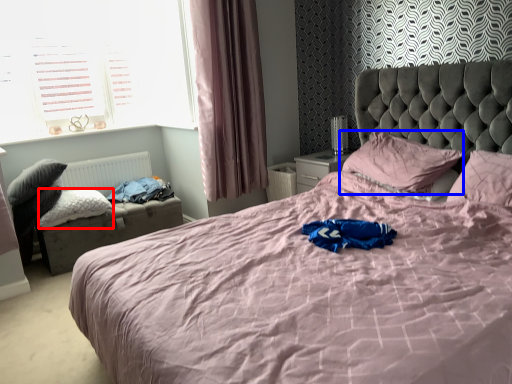
Question: Which object is further to the camera taking this photo, pillow (highlighted by a red box) or pillow (highlighted by a blue box)?

Choices:
 (A) pillow
 (B) pillow

Answer: (A)